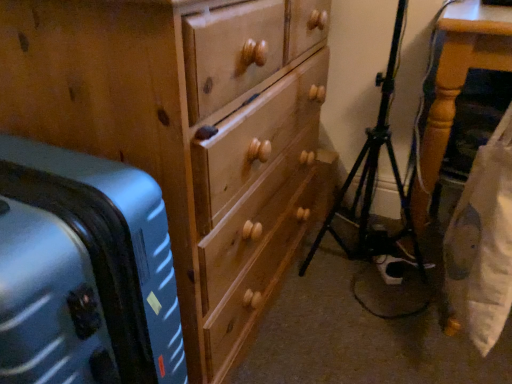
Question: From a real-world perspective, is wooden table at right located beneath wooden chest of drawers at center?

Choices:
 (A) no
 (B) yes

Answer: (B)

Question: Considering the relative positions of wooden table at right and wooden chest of drawers at center in the image provided, is wooden table at right to the left of wooden chest of drawers at center from the viewer's perspective?

Choices:
 (A) yes
 (B) no

Answer: (B)

Question: From the image's perspective, is wooden table at right located above wooden chest of drawers at center?

Choices:
 (A) yes
 (B) no

Answer: (A)

Question: Can you confirm if wooden table at right is smaller than wooden chest of drawers at center?

Choices:
 (A) yes
 (B) no

Answer: (A)

Question: From a real-world perspective, is wooden table at right located higher than wooden chest of drawers at center?

Choices:
 (A) yes
 (B) no

Answer: (B)

Question: Can you confirm if wooden table at right is positioned to the right of wooden chest of drawers at center?

Choices:
 (A) no
 (B) yes

Answer: (B)

Question: Does wooden chest of drawers at center have a greater height compared to black metal tripod at lower right?

Choices:
 (A) yes
 (B) no

Answer: (A)

Question: Would you say black metal tripod at lower right is part of wooden chest of drawers at center's contents?

Choices:
 (A) no
 (B) yes

Answer: (A)

Question: Is wooden chest of drawers at center closer to the viewer compared to black metal tripod at lower right?

Choices:
 (A) yes
 (B) no

Answer: (A)

Question: Considering the relative sizes of wooden chest of drawers at center and black metal tripod at lower right in the image provided, is wooden chest of drawers at center smaller than black metal tripod at lower right?

Choices:
 (A) no
 (B) yes

Answer: (A)

Question: Considering the relative positions of wooden chest of drawers at center and black metal tripod at lower right in the image provided, is wooden chest of drawers at center behind black metal tripod at lower right?

Choices:
 (A) yes
 (B) no

Answer: (B)

Question: Can you confirm if wooden chest of drawers at center is bigger than black metal tripod at lower right?

Choices:
 (A) yes
 (B) no

Answer: (A)

Question: Considering the relative positions of wooden table at right and metallic blue suitcase at left in the image provided, is wooden table at right to the right of metallic blue suitcase at left from the viewer's perspective?

Choices:
 (A) no
 (B) yes

Answer: (B)